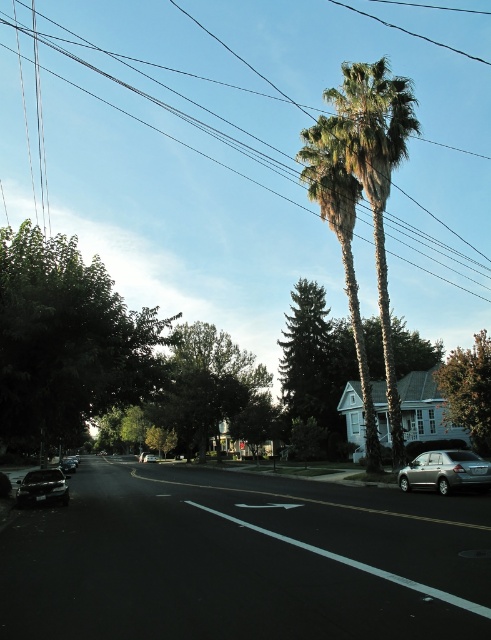
You are a delivery driver who needs to park your truck between the green leafy tree at center and the silver metallic sedan at center. Can your truck fit in the space between them?

The green leafy tree at center is wider than the silver metallic sedan at center. The space between them may be narrower than the truck, so it might not fit. Check the distance carefully before attempting to park.

You are a delivery driver who needs to park your vehicle in the suburban street scene shown. The parking spot for the delivery is at coordinates point 0.762, 0.088. Is the shiny silver sedan at lower left currently occupying that parking spot?

The shiny silver sedan at lower left is located at point (x=43, y=486), so yes, it is occupying the parking spot at those coordinates.